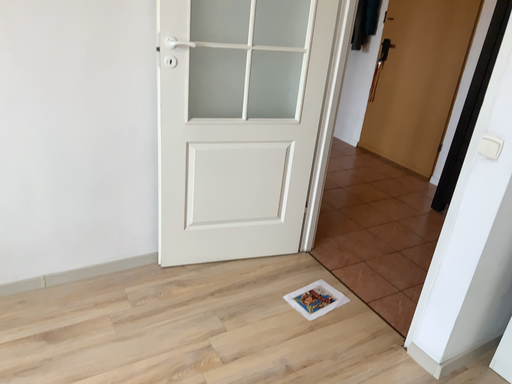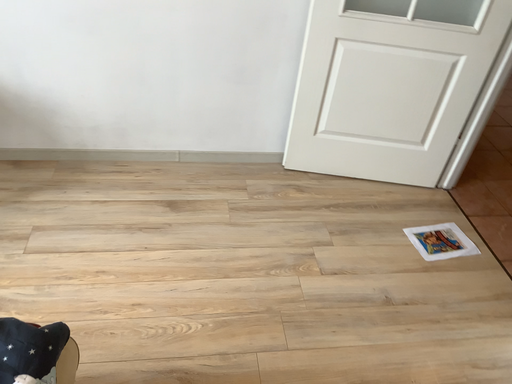
Question: Which way did the camera rotate in the video?

Choices:
 (A) rotated upward
 (B) rotated downward

Answer: (B)